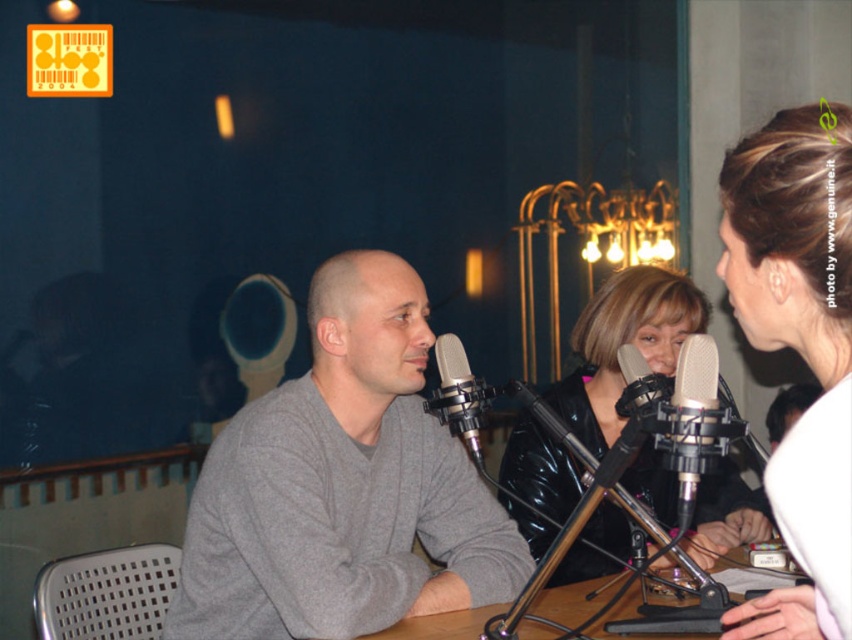
Which is below, smooth white blouse at center or white matte microphone at center?

smooth white blouse at center is below.

From the picture: Does smooth white blouse at center appear on the left side of white matte microphone at center?

No, smooth white blouse at center is not to the left of white matte microphone at center.

Image resolution: width=852 pixels, height=640 pixels. Describe the element at coordinates (798, 346) in the screenshot. I see `smooth white blouse at center` at that location.

Locate an element on the screen. The width and height of the screenshot is (852, 640). smooth white blouse at center is located at coordinates (798, 346).

Is smooth white blouse at center wider than wooden table at center?

Incorrect, smooth white blouse at center's width does not surpass wooden table at center's.

Describe the element at coordinates (798, 346) in the screenshot. I see `smooth white blouse at center` at that location.

This screenshot has width=852, height=640. Identify the location of smooth white blouse at center. (798, 346).

Which is behind, point (389, 580) or point (597, 625)?

Positioned behind is point (389, 580).

Is gray matte sweater at center shorter than wooden table at center?

Incorrect, gray matte sweater at center's height does not fall short of wooden table at center's.

Does point (297, 579) come behind point (548, 634)?

No.

At what (x,y) coordinates should I click in order to perform the action: click on gray matte sweater at center. Please return your answer as a coordinate pair (x, y). This screenshot has height=640, width=852. Looking at the image, I should click on click(x=343, y=484).